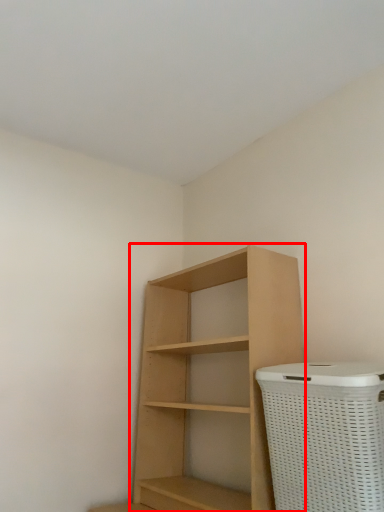
Question: In this image, where is shelf (annotated by the red box) located relative to basket container?

Choices:
 (A) right
 (B) left

Answer: (B)